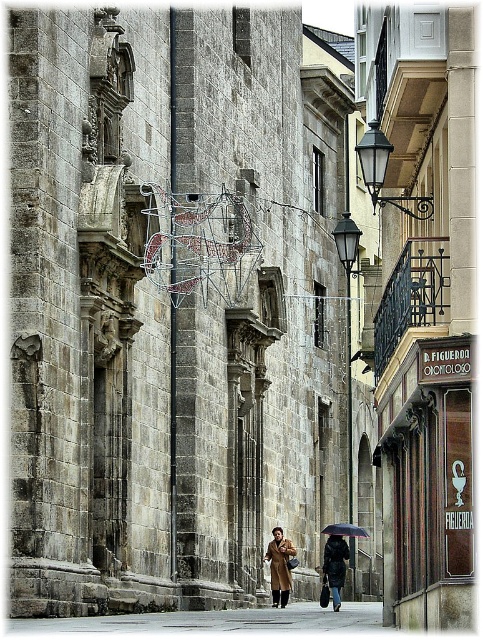
Question: Which of the following is the farthest from the observer?

Choices:
 (A) (326, 541)
 (B) (289, 572)

Answer: (A)

Question: Does brown leather coat at center appear over dark brown leather coat at center?

Choices:
 (A) no
 (B) yes

Answer: (B)

Question: Based on their relative distances, which object is nearer to the brown wool coat at center?

Choices:
 (A) dark brown leather coat at center
 (B) gray concrete pavement at center

Answer: (A)

Question: Which point is farther to the camera?

Choices:
 (A) gray concrete pavement at center
 (B) brown leather coat at center
 (C) black matte umbrella at center
 (D) brown wool coat at center

Answer: (C)

Question: Is dark brown leather coat at center to the left of black matte umbrella at center from the viewer's perspective?

Choices:
 (A) no
 (B) yes

Answer: (B)

Question: Is brown wool coat at center above black matte umbrella at center?

Choices:
 (A) no
 (B) yes

Answer: (B)